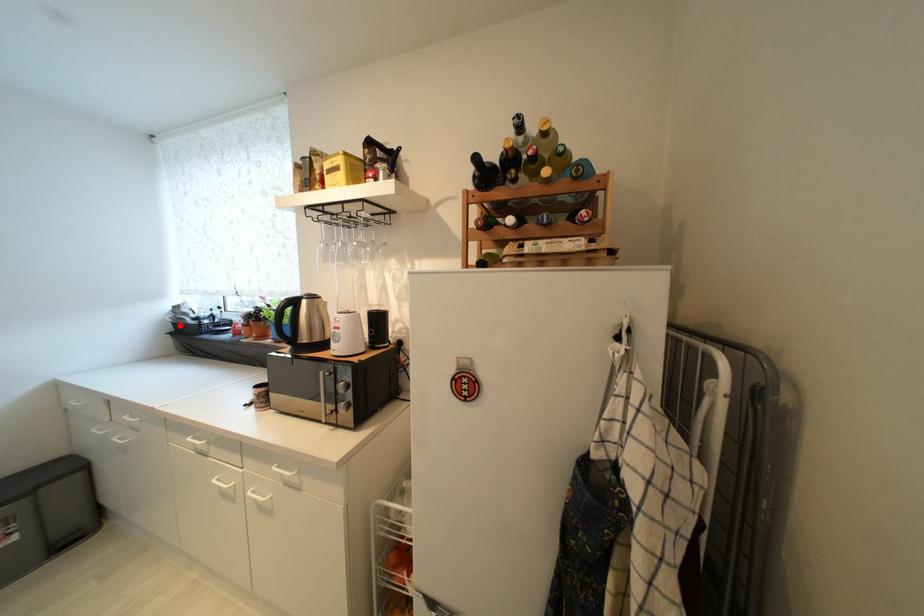
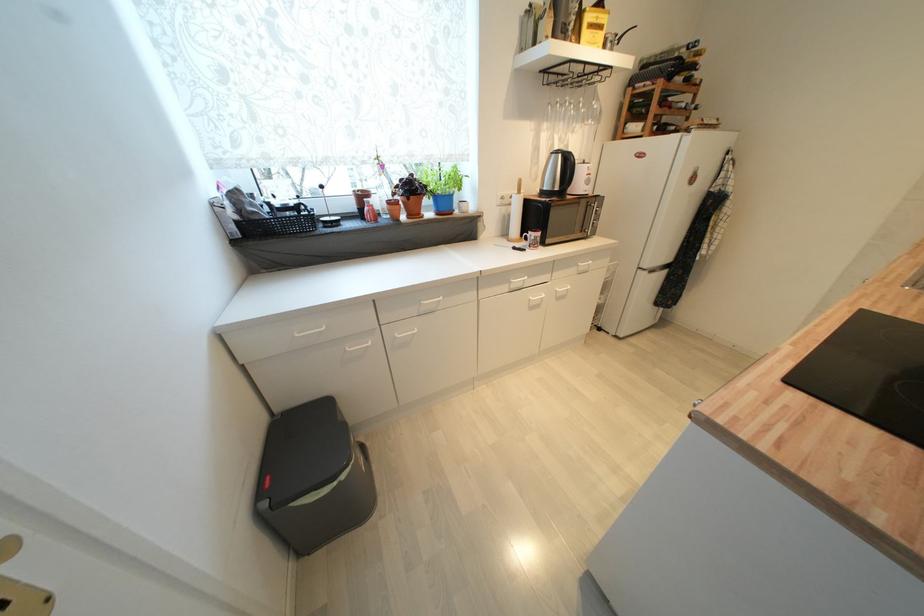
The point at the highlighted location is marked in the first image. Where is the corresponding point in the second image?

(242, 225)